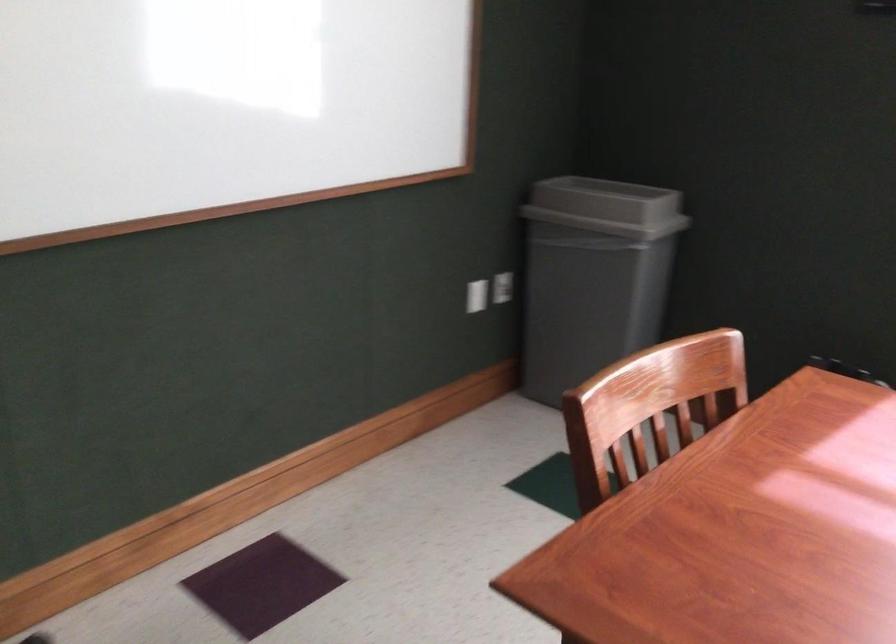
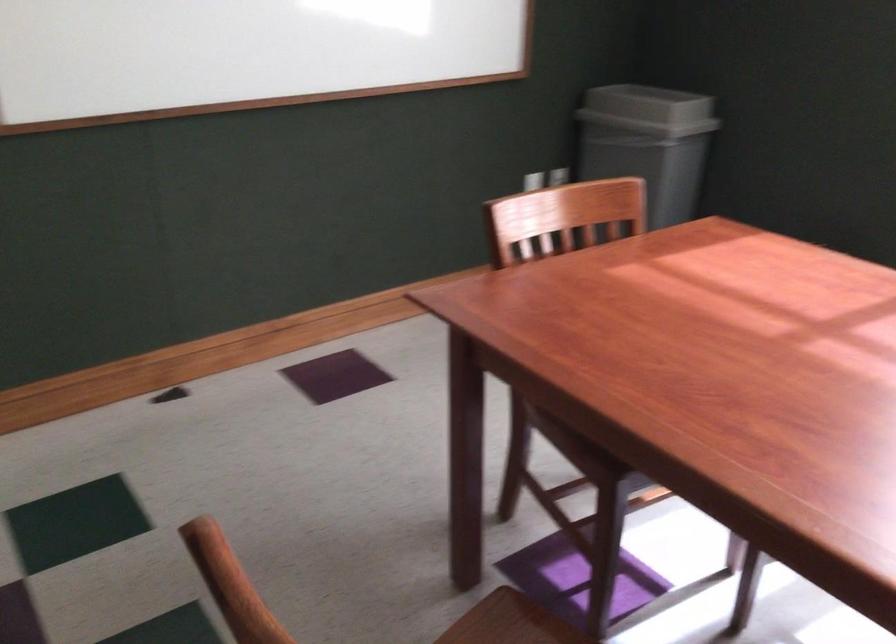
Question: How did the camera likely rotate?

Choices:
 (A) Left
 (B) Right
 (C) Up
 (D) Down

Answer: (A)